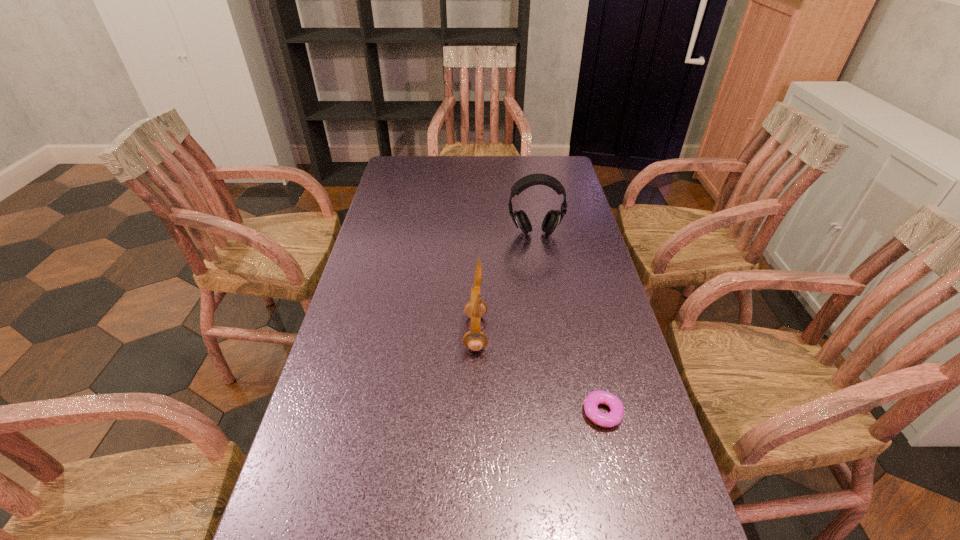
Identify the location of free spot between the nearest object and the farther earphone. Image resolution: width=960 pixels, height=540 pixels. (568, 323).

You are a GUI agent. You are given a task and a screenshot of the screen. Output one action in this format:
    pyautogui.click(x=<x>, y=<y>)
    Task: Click on the empty space that is in between the farther earphone and the second farthest object
    
    Given the screenshot: What is the action you would take?
    pyautogui.click(x=505, y=283)

Find the location of `unoccupied area between the second farthest object and the right earphone`. unoccupied area between the second farthest object and the right earphone is located at coordinates (505, 283).

The width and height of the screenshot is (960, 540). I want to click on free area in between the nearest object and the second farthest object, so [539, 373].

You are a GUI agent. You are given a task and a screenshot of the screen. Output one action in this format:
    pyautogui.click(x=<x>, y=<y>)
    Task: Click on the free spot between the second farthest object and the doughnut
    The image size is (960, 540).
    Given the screenshot: What is the action you would take?
    pyautogui.click(x=539, y=373)

The height and width of the screenshot is (540, 960). Find the location of `unoccupied position between the left earphone and the shortest object`. unoccupied position between the left earphone and the shortest object is located at coordinates (539, 373).

Identify which object is the second nearest to the farthest object. Please provide its 2D coordinates. Your answer should be formatted as a tuple, i.e. [(x, y)], where the tuple contains the x and y coordinates of a point satisfying the conditions above.

[(593, 399)]

Identify which object is the second nearest to the farthest object. Please provide its 2D coordinates. Your answer should be formatted as a tuple, i.e. [(x, y)], where the tuple contains the x and y coordinates of a point satisfying the conditions above.

[(593, 399)]

Identify the location of free location that satisfies the following two spatial constraints: 1. on the ear cups of the farthest object; 2. on the front-facing side of the left earphone. (551, 333).

This screenshot has width=960, height=540. Identify the location of free space that satisfies the following two spatial constraints: 1. on the ear cups of the farther earphone; 2. on the left side of the shortest object. (564, 413).